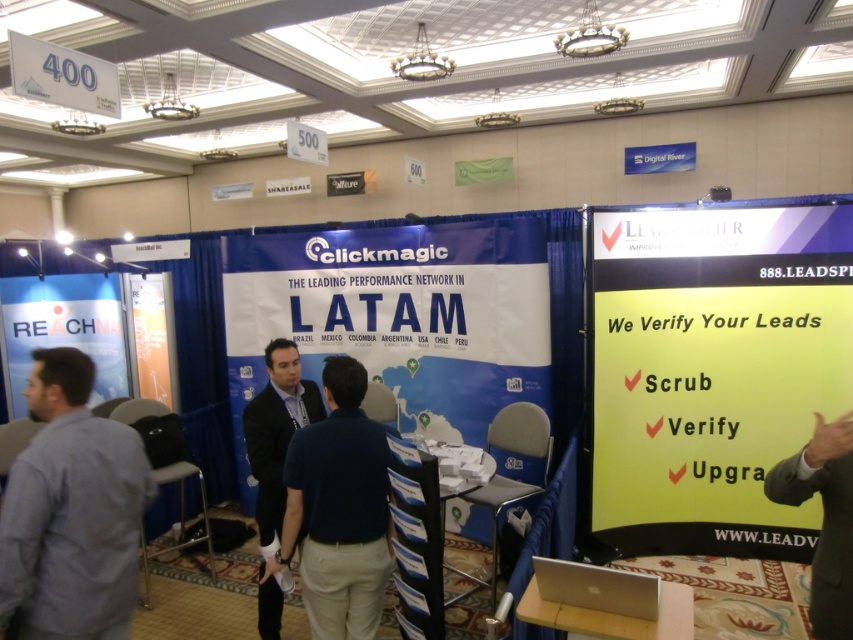
You are at a trade show booth and see the gray shirt at left and the slate gray suit at right. Which person is taller?

The gray shirt at left is taller than the slate gray suit at right.

You are a photographer at the event and need to capture a clear photo of both the dark blue shirt at center and the dark blue suit at center. Which one appears wider in the photo?

The dark blue shirt at center appears wider in the photo because its width is larger than that of the dark blue suit at center.